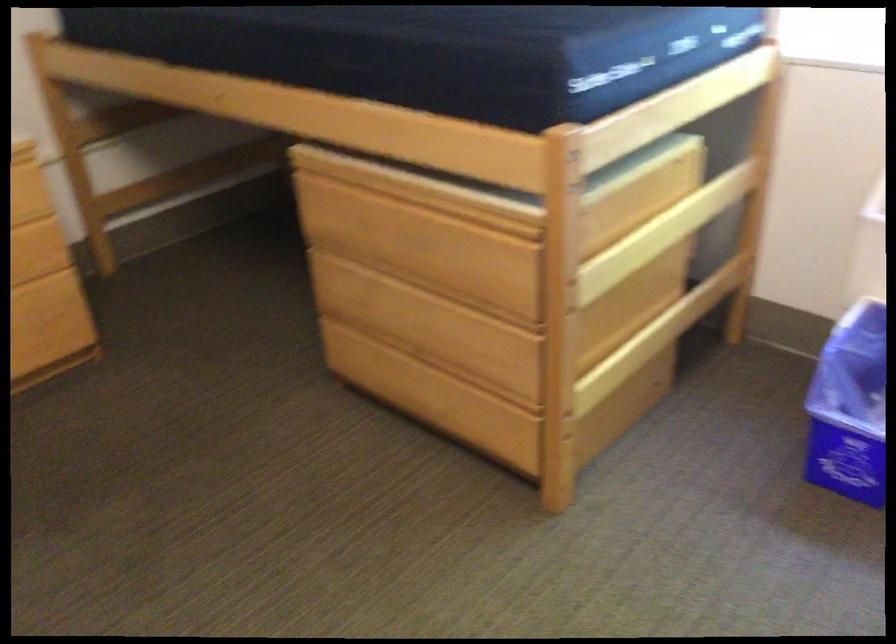
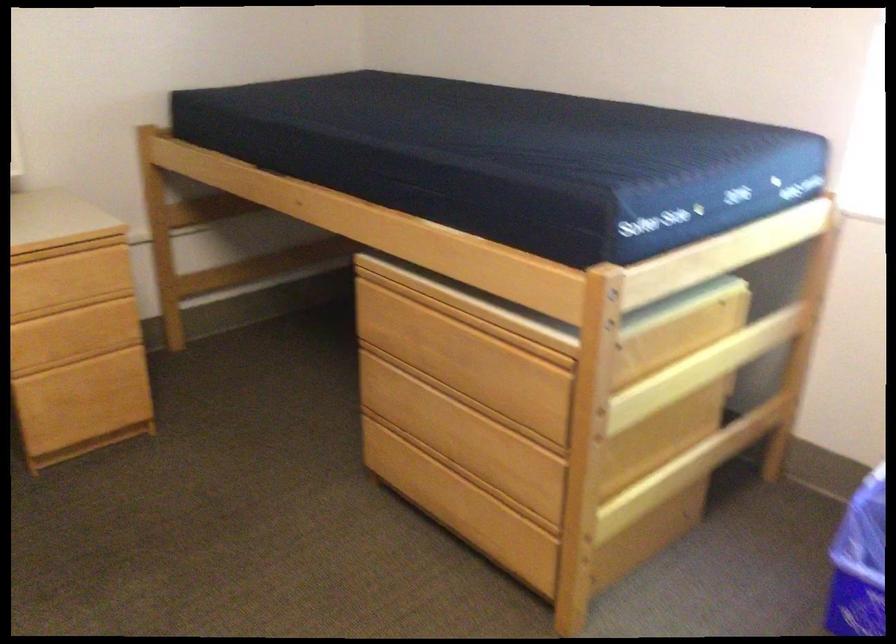
In the second image, find the point that corresponds to (x=412, y=281) in the first image.

(452, 392)